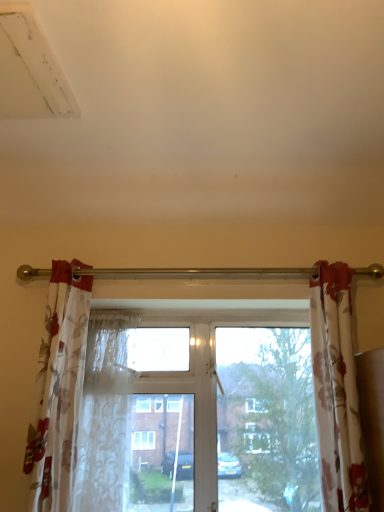
The width and height of the screenshot is (384, 512). Identify the location of floral sheer curtain at left, the second curtain in the right-to-left sequence. (59, 390).

Locate an element on the screen. The image size is (384, 512). transparent glass window at center is located at coordinates (92, 412).

Find the location of a particular element. floral sheer curtain at left, the second curtain in the right-to-left sequence is located at coordinates (59, 390).

Is translucent floral fabric at center to the right of floral sheer curtain at left, marked as the first curtain in a left-to-right arrangement, from the viewer's perspective?

Yes.

Between translucent floral fabric at center and floral sheer curtain at left, the second curtain in the right-to-left sequence, which one has larger width?

Wider between the two is floral sheer curtain at left, the second curtain in the right-to-left sequence.

Which is behind, translucent floral fabric at center or floral sheer curtain at left, marked as the first curtain in a left-to-right arrangement?

Positioned behind is translucent floral fabric at center.

Are translucent floral fabric at center and floral sheer curtain at left, the second curtain in the right-to-left sequence, making contact?

A: No, translucent floral fabric at center is not touching floral sheer curtain at left, the second curtain in the right-to-left sequence.

From the picture: Is floral fabric curtain at right, which is the 1th curtain in right-to-left order, looking in the opposite direction of transparent glass window at center?

Absolutely, floral fabric curtain at right, which is the 1th curtain in right-to-left order, is directed away from transparent glass window at center.

From the image's perspective, is floral fabric curtain at right, which is the 1th curtain in right-to-left order, on top of transparent glass window at center?

Yes, from the image's perspective, floral fabric curtain at right, which is the 1th curtain in right-to-left order, is over transparent glass window at center.

Which is in front, floral fabric curtain at right, the 2th curtain when ordered from left to right, or transparent glass window at center?

floral fabric curtain at right, the 2th curtain when ordered from left to right.

Are floral sheer curtain at left, marked as the first curtain in a left-to-right arrangement, and floral fabric curtain at right, which is the 1th curtain in right-to-left order, far apart?

floral sheer curtain at left, marked as the first curtain in a left-to-right arrangement, is near floral fabric curtain at right, which is the 1th curtain in right-to-left order, not far away.

From a real-world perspective, is floral sheer curtain at left, marked as the first curtain in a left-to-right arrangement, physically below floral fabric curtain at right, the 2th curtain when ordered from left to right?

Yes, from a real-world perspective, floral sheer curtain at left, marked as the first curtain in a left-to-right arrangement, is beneath floral fabric curtain at right, the 2th curtain when ordered from left to right.

Considering the positions of objects floral sheer curtain at left, the second curtain in the right-to-left sequence, and floral fabric curtain at right, the 2th curtain when ordered from left to right, in the image provided, who is more to the right, floral sheer curtain at left, the second curtain in the right-to-left sequence, or floral fabric curtain at right, the 2th curtain when ordered from left to right,?

From the viewer's perspective, floral fabric curtain at right, the 2th curtain when ordered from left to right, appears more on the right side.

Measure the distance between floral sheer curtain at left, the second curtain in the right-to-left sequence, and translucent floral fabric at center.

floral sheer curtain at left, the second curtain in the right-to-left sequence, is 19.09 centimeters away from translucent floral fabric at center.

Is floral sheer curtain at left, the second curtain in the right-to-left sequence, next to translucent floral fabric at center and touching it?

There is a gap between floral sheer curtain at left, the second curtain in the right-to-left sequence, and translucent floral fabric at center.

Considering the sizes of objects floral sheer curtain at left, marked as the first curtain in a left-to-right arrangement, and translucent floral fabric at center in the image provided, who is thinner, floral sheer curtain at left, marked as the first curtain in a left-to-right arrangement, or translucent floral fabric at center?

Thinner between the two is translucent floral fabric at center.

Between floral sheer curtain at left, marked as the first curtain in a left-to-right arrangement, and translucent floral fabric at center, which one is positioned in front?

Positioned in front is floral sheer curtain at left, marked as the first curtain in a left-to-right arrangement.

Consider the image. Does transparent glass window at center have a greater height compared to floral sheer curtain at left, marked as the first curtain in a left-to-right arrangement?

No, transparent glass window at center is not taller than floral sheer curtain at left, marked as the first curtain in a left-to-right arrangement.

You are a GUI agent. You are given a task and a screenshot of the screen. Output one action in this format:
    pyautogui.click(x=<x>, y=<y>)
    Task: Click on the curtain that is the 1st object above the transparent glass window at center (from a real-world perspective)
    
    Given the screenshot: What is the action you would take?
    pyautogui.click(x=59, y=390)

From the image's perspective, between transparent glass window at center and floral sheer curtain at left, the second curtain in the right-to-left sequence, which one is located above?

From the image's view, floral sheer curtain at left, the second curtain in the right-to-left sequence, is above.

Which object is positioned more to the left, transparent glass window at center or floral sheer curtain at left, the second curtain in the right-to-left sequence?

floral sheer curtain at left, the second curtain in the right-to-left sequence.

From a real-world perspective, is transparent glass window at center above or below translucent floral fabric at center?

In terms of real-world spatial position, transparent glass window at center is below translucent floral fabric at center.

Considering the positions of points (223, 471) and (109, 354), is point (223, 471) closer to camera compared to point (109, 354)?

That is True.

Considering the sizes of objects transparent glass window at center and translucent floral fabric at center in the image provided, who is taller, transparent glass window at center or translucent floral fabric at center?

transparent glass window at center.

This screenshot has height=512, width=384. Find the location of `shower curtain positioned vertically above the transparent glass window at center (from a real-world perspective)`. shower curtain positioned vertically above the transparent glass window at center (from a real-world perspective) is located at coordinates (105, 415).

Looking at this image, considering the sizes of objects translucent floral fabric at center and transparent glass window at center in the image provided, who is wider, translucent floral fabric at center or transparent glass window at center?

translucent floral fabric at center.

From the image's perspective, which is above, translucent floral fabric at center or transparent glass window at center?

From the image's view, translucent floral fabric at center is above.

Is translucent floral fabric at center oriented away from transparent glass window at center?

Correct, translucent floral fabric at center is looking away from transparent glass window at center.

Where is `curtain that is the 2nd object located in front of the translucent floral fabric at center`? The image size is (384, 512). curtain that is the 2nd object located in front of the translucent floral fabric at center is located at coordinates (59, 390).

Locate an element on the screen. window lying behind the floral fabric curtain at right, which is the 1th curtain in right-to-left order is located at coordinates (92, 412).

Estimate the real-world distances between objects in this image. Which object is further from transparent glass window at center, translucent floral fabric at center or floral sheer curtain at left, marked as the first curtain in a left-to-right arrangement?

floral sheer curtain at left, marked as the first curtain in a left-to-right arrangement, is positioned further to the anchor transparent glass window at center.

Looking at the image, which one is located closer to transparent glass window at center, floral fabric curtain at right, which is the 1th curtain in right-to-left order, or translucent floral fabric at center?

translucent floral fabric at center is positioned closer to the anchor transparent glass window at center.

Looking at the image, which one is located closer to floral fabric curtain at right, the 2th curtain when ordered from left to right, transparent glass window at center or floral sheer curtain at left, marked as the first curtain in a left-to-right arrangement?

transparent glass window at center.

From the image, which object appears to be farther from floral sheer curtain at left, marked as the first curtain in a left-to-right arrangement, floral fabric curtain at right, the 2th curtain when ordered from left to right, or translucent floral fabric at center?

floral fabric curtain at right, the 2th curtain when ordered from left to right.

Which object lies further to the anchor point transparent glass window at center, floral fabric curtain at right, which is the 1th curtain in right-to-left order, or floral sheer curtain at left, the second curtain in the right-to-left sequence?

floral fabric curtain at right, which is the 1th curtain in right-to-left order, is further to transparent glass window at center.

Looking at the image, which one is located further to translucent floral fabric at center, transparent glass window at center or floral fabric curtain at right, which is the 1th curtain in right-to-left order?

Based on the image, floral fabric curtain at right, which is the 1th curtain in right-to-left order, appears to be further to translucent floral fabric at center.

Looking at the image, which one is located further to translucent floral fabric at center, floral sheer curtain at left, marked as the first curtain in a left-to-right arrangement, or transparent glass window at center?

Among the two, floral sheer curtain at left, marked as the first curtain in a left-to-right arrangement, is located further to translucent floral fabric at center.

Estimate the real-world distances between objects in this image. Which object is further from translucent floral fabric at center, floral fabric curtain at right, the 2th curtain when ordered from left to right, or floral sheer curtain at left, marked as the first curtain in a left-to-right arrangement?

floral fabric curtain at right, the 2th curtain when ordered from left to right, is positioned further to the anchor translucent floral fabric at center.

Identify the location of shower curtain between floral sheer curtain at left, marked as the first curtain in a left-to-right arrangement, and floral fabric curtain at right, the 2th curtain when ordered from left to right, in the horizontal direction. (105, 415).

Find the location of a particular element. This screenshot has width=384, height=512. window between floral sheer curtain at left, marked as the first curtain in a left-to-right arrangement, and floral fabric curtain at right, which is the 1th curtain in right-to-left order, from left to right is located at coordinates (92, 412).

I want to click on window between translucent floral fabric at center and floral fabric curtain at right, which is the 1th curtain in right-to-left order, in the horizontal direction, so click(92, 412).

The height and width of the screenshot is (512, 384). Find the location of `shower curtain situated between floral sheer curtain at left, the second curtain in the right-to-left sequence, and transparent glass window at center from left to right`. shower curtain situated between floral sheer curtain at left, the second curtain in the right-to-left sequence, and transparent glass window at center from left to right is located at coordinates (105, 415).